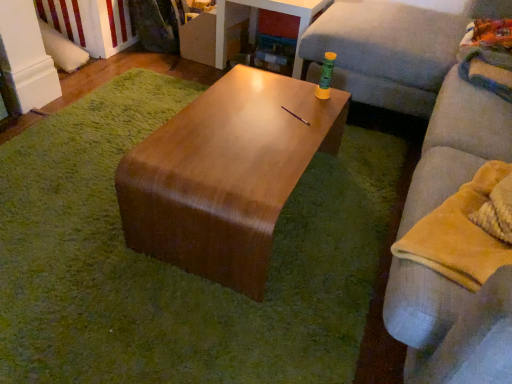
Where is `free point above shiny brown coffee table at center (from a real-world perspective)`? free point above shiny brown coffee table at center (from a real-world perspective) is located at coordinates (249, 134).